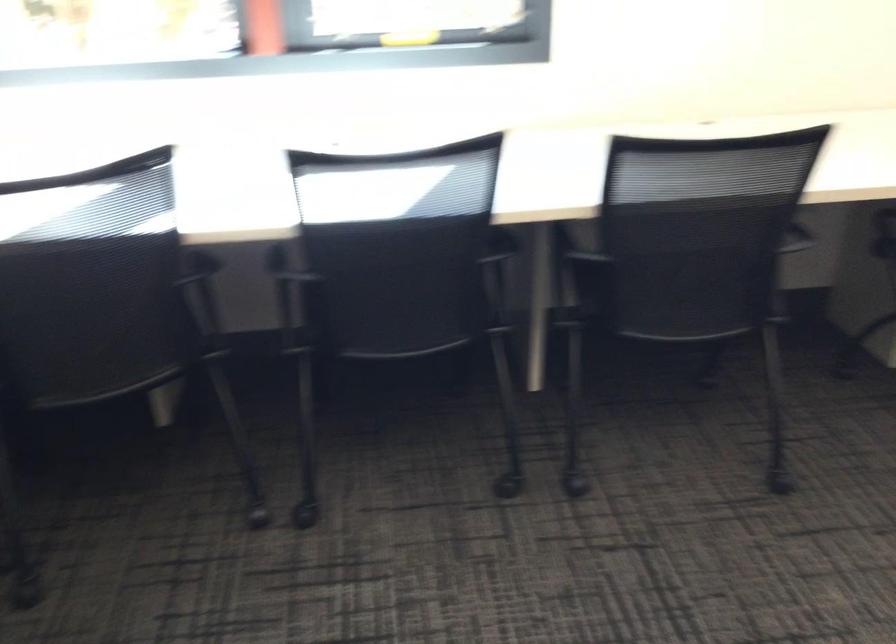
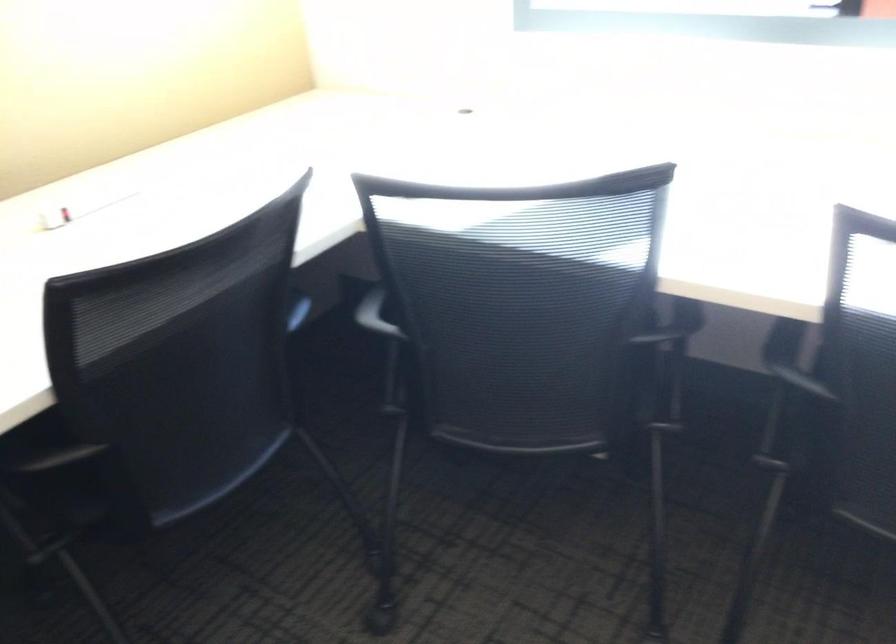
Question: The camera is either moving clockwise (left) or counter-clockwise (right) around the object. The first image is from the beginning of the video and the second image is from the end. Is the camera moving left or right when shooting the video?

Choices:
 (A) Left
 (B) Right

Answer: (B)